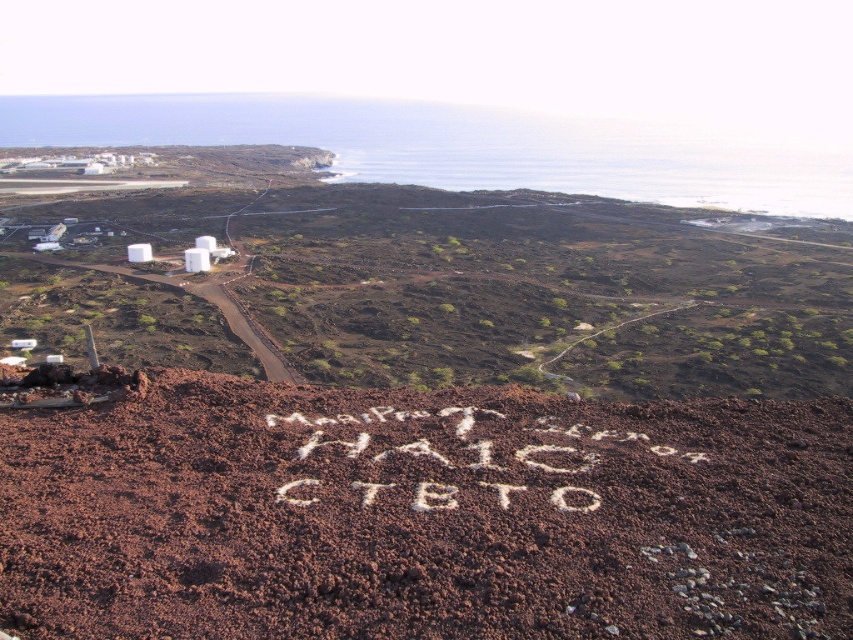
Is point (376, 605) in front of point (328, 435)?

That is True.

Is brown dirt at center taller than white sand at center?

Yes.

Is point (665, 632) in front of point (604, 445)?

Yes, point (665, 632) is in front of point (604, 445).

The width and height of the screenshot is (853, 640). I want to click on brown dirt at center, so click(x=422, y=515).